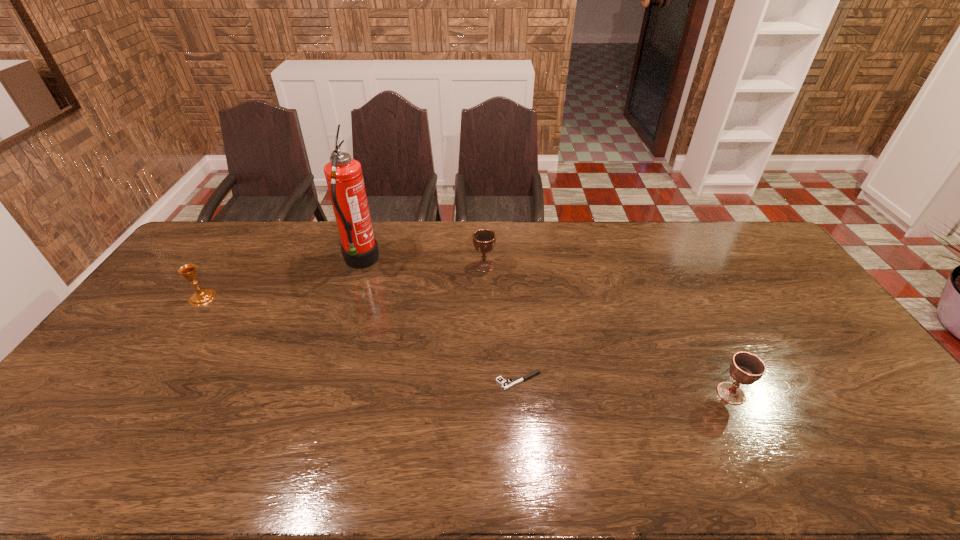
The width and height of the screenshot is (960, 540). What are the coordinates of `vacant area situated 0.260m on the right of the rightmost chalice` in the screenshot? It's located at pyautogui.click(x=845, y=394).

Identify the location of free location located 0.340m on the front of the second farthest chalice. The image size is (960, 540). (133, 399).

Locate an element on the screen. vacant space located on the front-facing side of the pistol is located at coordinates (350, 381).

Image resolution: width=960 pixels, height=540 pixels. I want to click on blank space located on the front-facing side of the pistol, so click(451, 381).

Find the location of a particular element. free space located on the front-facing side of the pistol is located at coordinates (370, 381).

Identify the location of fire extinguisher located at the far edge. The width and height of the screenshot is (960, 540). pyautogui.click(x=344, y=177).

This screenshot has height=540, width=960. Identify the location of chalice that is at the far edge. (484, 240).

You are a GUI agent. You are given a task and a screenshot of the screen. Output one action in this format:
    pyautogui.click(x=<x>, y=<y>)
    Task: Click on the object present at the left edge
    
    Given the screenshot: What is the action you would take?
    pyautogui.click(x=202, y=297)

In the image, there is a desktop. At what (x,y) coordinates should I click in order to perform the action: click on vacant area at the far edge. Please return your answer as a coordinate pair (x, y). This screenshot has width=960, height=540. Looking at the image, I should click on [549, 247].

In the image, there is a desktop. Where is `vacant space at the near edge`? vacant space at the near edge is located at coordinates (636, 452).